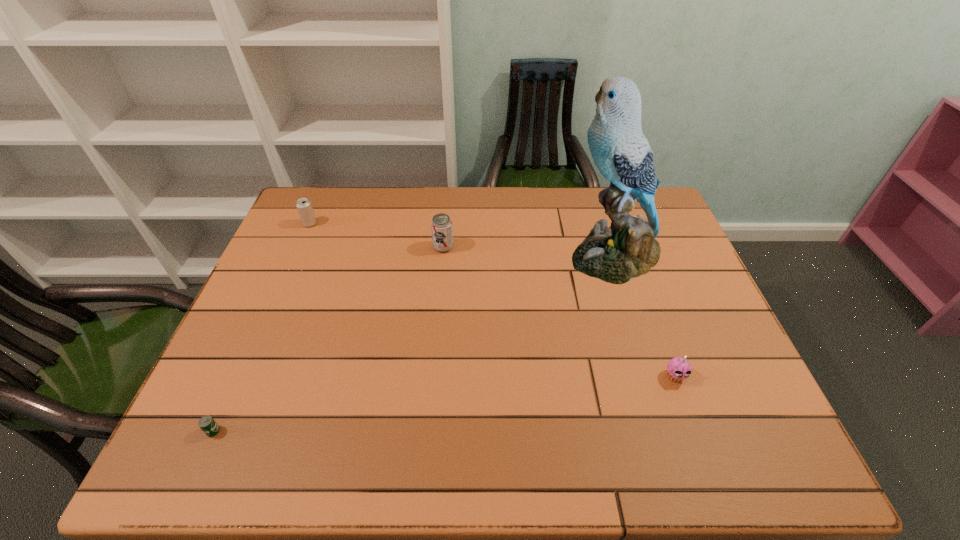
Locate an element on the screen. vacant space located on the face of the parakeet is located at coordinates (450, 255).

The image size is (960, 540). I want to click on free spot located 0.250m on the left of the rightmost beer can, so click(x=350, y=247).

This screenshot has height=540, width=960. Identify the location of free location located on the front of the farthest beer can. (275, 303).

Locate an element on the screen. The width and height of the screenshot is (960, 540). vacant space located 0.190m on the face of the fourth farthest object is located at coordinates (709, 470).

Image resolution: width=960 pixels, height=540 pixels. In order to click on vacant space located on the right of the nearest beer can in this screenshot , I will do `click(358, 431)`.

This screenshot has width=960, height=540. In order to click on parakeet that is at the far edge in this screenshot , I will do 627,249.

The width and height of the screenshot is (960, 540). I want to click on beer can that is at the far edge, so click(303, 205).

You are a GUI agent. You are given a task and a screenshot of the screen. Output one action in this format:
    pyautogui.click(x=<x>, y=<y>)
    Task: Click on the object that is at the near edge
    The width and height of the screenshot is (960, 540).
    Given the screenshot: What is the action you would take?
    pyautogui.click(x=207, y=424)

This screenshot has height=540, width=960. I want to click on parakeet located at the right edge, so click(x=627, y=249).

Find the location of a particular element. The height and width of the screenshot is (540, 960). cupcake at the right edge is located at coordinates (678, 369).